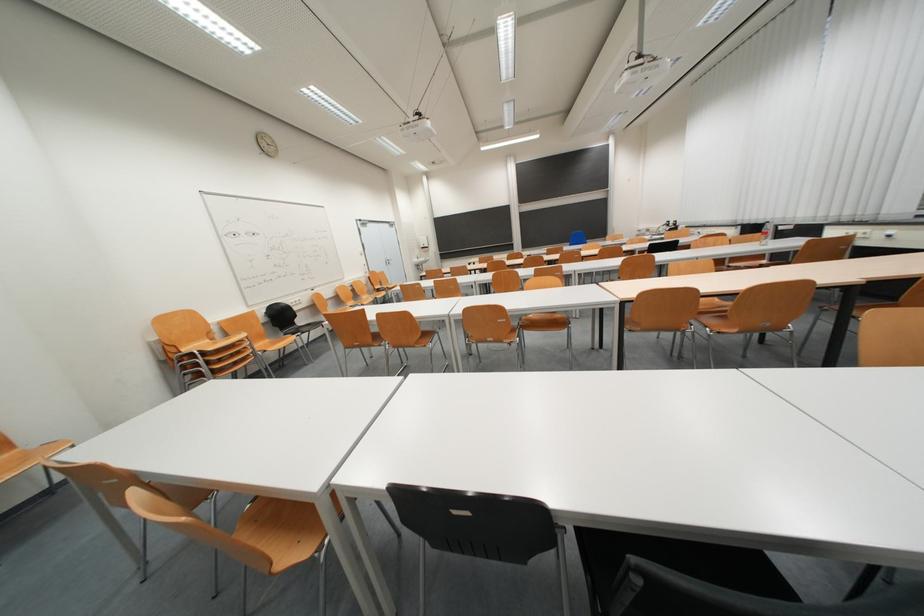
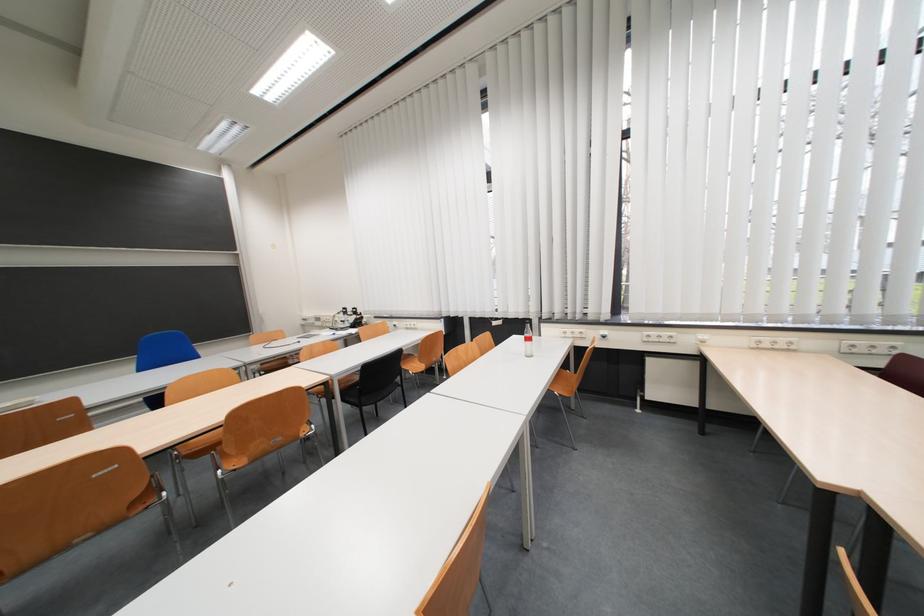
In the second image, find the point that corresponds to (x=678, y=228) in the first image.

(357, 315)